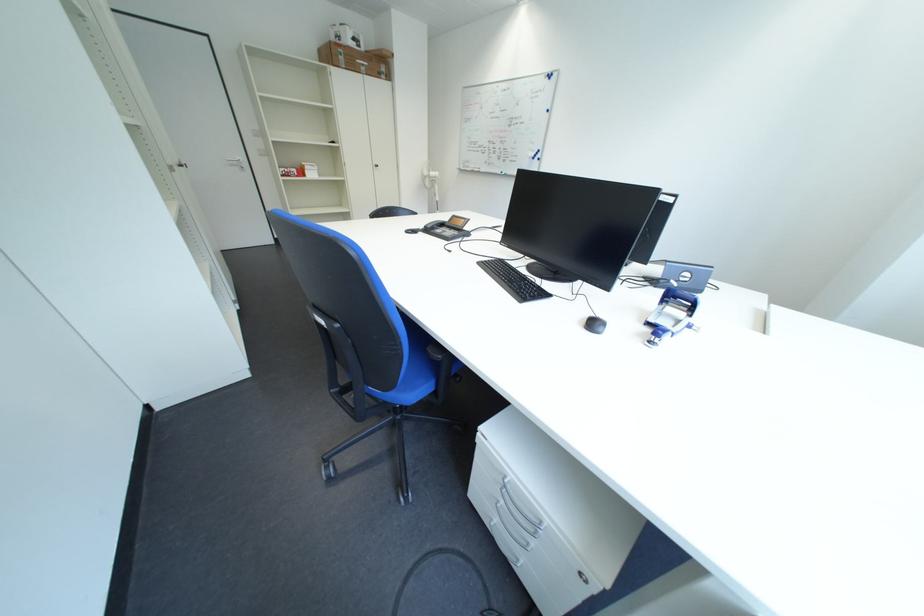
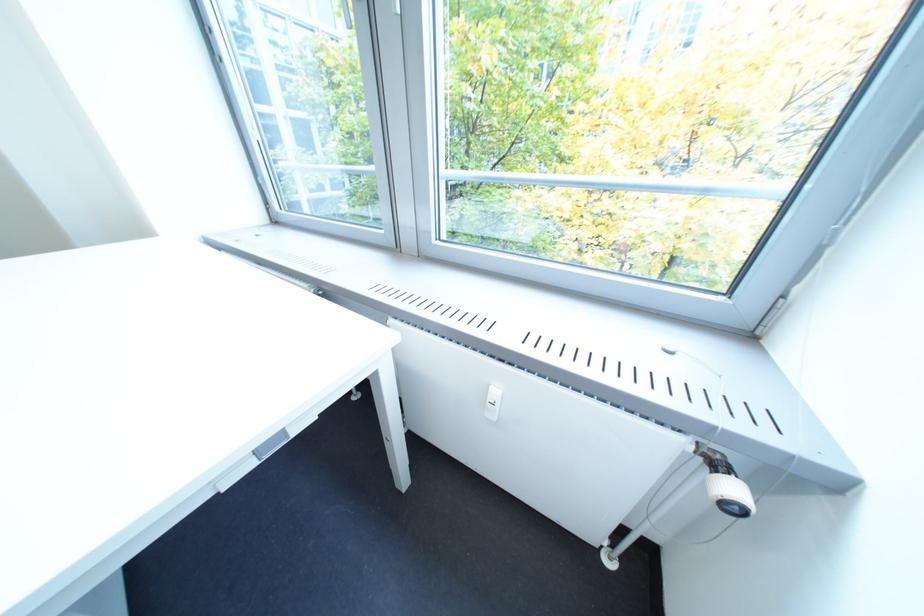
Based on the continuous images, in which direction is the camera rotating?

The rotation direction of the camera is right-down.